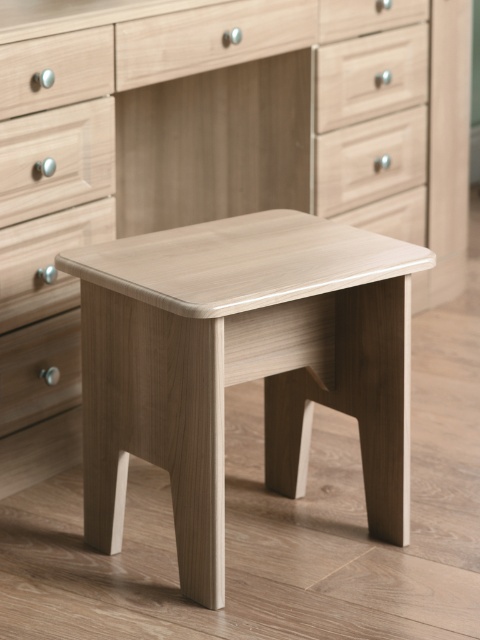
Which is behind, point (21, 150) or point (321, 76)?

The point (321, 76) is more distant.

Image resolution: width=480 pixels, height=640 pixels. What do you see at coordinates (56, 160) in the screenshot?
I see `light wood drawer at upper left` at bounding box center [56, 160].

Between point (103, 138) and point (336, 76), which one is positioned behind?

The point (336, 76) is more distant.

The height and width of the screenshot is (640, 480). Find the location of `light wood drawer at upper left`. light wood drawer at upper left is located at coordinates (56, 160).

Which of these two, matte wood drawer at upper right or matte wood drawer at upper center, stands taller?

matte wood drawer at upper right

Can you confirm if matte wood drawer at upper right is positioned above matte wood drawer at upper center?

No, matte wood drawer at upper right is not above matte wood drawer at upper center.

Between point (379, 113) and point (387, 12), which one is positioned in front?

Point (387, 12) is in front.

Locate an element on the screen. matte wood drawer at upper right is located at coordinates (371, 76).

Based on the photo, which of these two, matte wood drawer at upper right or light wood drawer at upper center, stands taller?

With more height is matte wood drawer at upper right.

Between matte wood drawer at upper right and light wood drawer at upper center, which one is positioned lower?

Positioned lower is light wood drawer at upper center.

Measure the distance between point (396,104) and camera.

A distance of 2.97 meters exists between point (396,104) and camera.

Image resolution: width=480 pixels, height=640 pixels. I want to click on matte wood drawer at upper right, so click(371, 76).